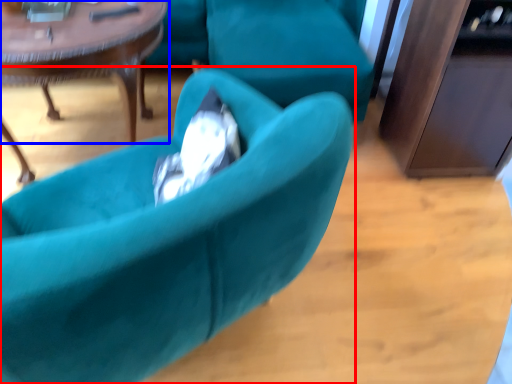
Question: Among these objects, which one is nearest to the camera, chair (highlighted by a red box) or coffee table (highlighted by a blue box)?

Choices:
 (A) chair
 (B) coffee table

Answer: (A)